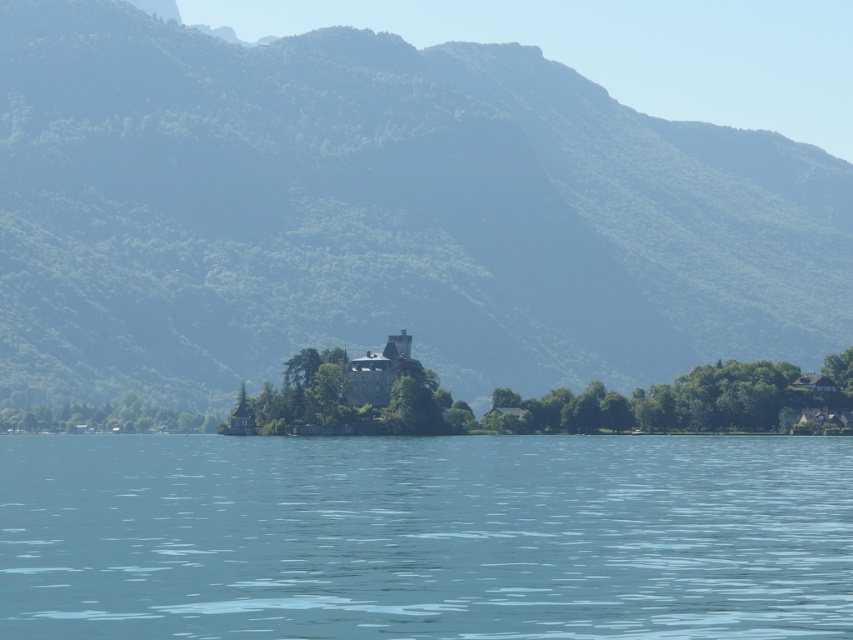
Which of these two, green textured mountain at center or transparent blue water at center, stands taller?

green textured mountain at center

Does green textured mountain at center have a larger size compared to transparent blue water at center?

Indeed, green textured mountain at center has a larger size compared to transparent blue water at center.

At what (x,y) coordinates should I click in order to perform the action: click on green textured mountain at center. Please return your answer as a coordinate pair (x, y). The height and width of the screenshot is (640, 853). Looking at the image, I should click on (381, 214).

Identify the location of green textured mountain at center. This screenshot has height=640, width=853. (381, 214).

Which of these two, transparent blue water at center or dark gray stone castle at center, stands taller?

Standing taller between the two is dark gray stone castle at center.

Between transparent blue water at center and dark gray stone castle at center, which one is positioned lower?

Positioned lower is transparent blue water at center.

Image resolution: width=853 pixels, height=640 pixels. In order to click on transparent blue water at center in this screenshot , I will do `click(425, 536)`.

Can you confirm if green textured mountain at center is wider than dark gray stone castle at center?

Correct, the width of green textured mountain at center exceeds that of dark gray stone castle at center.

Can you confirm if green textured mountain at center is positioned above dark gray stone castle at center?

Yes.

Image resolution: width=853 pixels, height=640 pixels. What do you see at coordinates (381, 214) in the screenshot?
I see `green textured mountain at center` at bounding box center [381, 214].

Where is `green textured mountain at center`? This screenshot has height=640, width=853. green textured mountain at center is located at coordinates (381, 214).